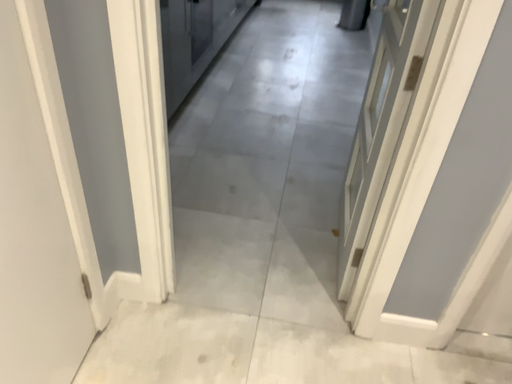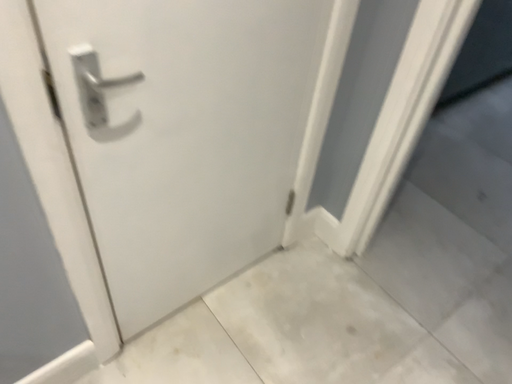
Question: Which way did the camera rotate in the video?

Choices:
 (A) rotated right
 (B) rotated left

Answer: (B)